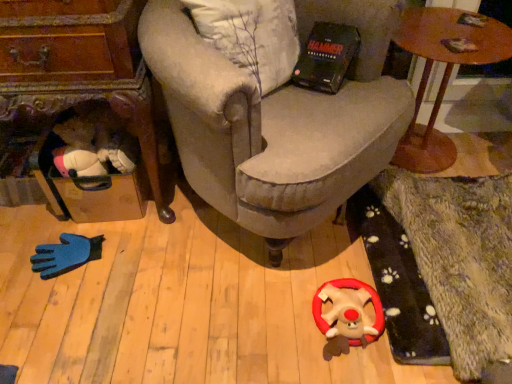
Locate an element on the screen. The height and width of the screenshot is (384, 512). vacant space underneath wooden round table at upper right, the first table in the right-to-left sequence (from a real-world perspective) is located at coordinates (432, 142).